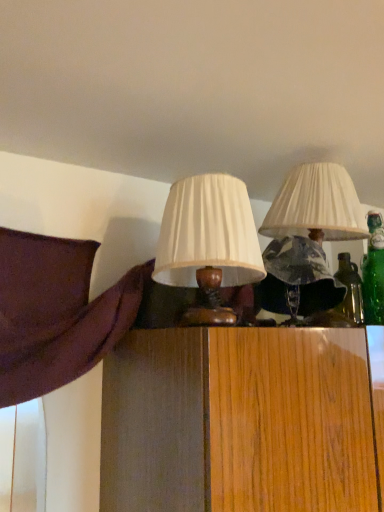
Question: Which direction should I rotate to look at matte white lampshade at center, which ranks as the 1th lamp in right-to-left order, — up or down?

Choices:
 (A) up
 (B) down

Answer: (A)

Question: Is matte white lampshade at center, which ranks as the 1th lamp in right-to-left order, positioned in front of matte white lampshade at center, the second lamp in the right-to-left sequence?

Choices:
 (A) no
 (B) yes

Answer: (A)

Question: From a real-world perspective, is matte white lampshade at center, which ranks as the 1th lamp in right-to-left order, located higher than matte white lampshade at center, placed as the first lamp when sorted from left to right?

Choices:
 (A) yes
 (B) no

Answer: (A)

Question: Is matte white lampshade at center, which ranks as the 1th lamp in right-to-left order, to the right of matte white lampshade at center, the second lamp in the right-to-left sequence, from the viewer's perspective?

Choices:
 (A) no
 (B) yes

Answer: (B)

Question: Is matte white lampshade at center, placed as the first lamp when sorted from left to right, located within matte white lampshade at center, the second lamp positioned from the left?

Choices:
 (A) no
 (B) yes

Answer: (A)

Question: Is matte white lampshade at center, placed as the first lamp when sorted from left to right, at the back of matte white lampshade at center, which ranks as the 1th lamp in right-to-left order?

Choices:
 (A) yes
 (B) no

Answer: (B)

Question: Does matte white lampshade at center, the second lamp positioned from the left, have a lesser height compared to matte white lampshade at center, placed as the first lamp when sorted from left to right?

Choices:
 (A) no
 (B) yes

Answer: (A)

Question: Is matte white lampshade at center, the second lamp in the right-to-left sequence, turned away from matte white lampshade at center, which ranks as the 1th lamp in right-to-left order?

Choices:
 (A) yes
 (B) no

Answer: (B)

Question: Is matte white lampshade at center, the second lamp in the right-to-left sequence, behind matte white lampshade at center, which ranks as the 1th lamp in right-to-left order?

Choices:
 (A) yes
 (B) no

Answer: (B)

Question: Does matte white lampshade at center, the second lamp in the right-to-left sequence, have a lesser width compared to matte white lampshade at center, the second lamp positioned from the left?

Choices:
 (A) no
 (B) yes

Answer: (B)

Question: Is matte white lampshade at center, placed as the first lamp when sorted from left to right, shorter than matte white lampshade at center, which ranks as the 1th lamp in right-to-left order?

Choices:
 (A) no
 (B) yes

Answer: (B)

Question: From a real-world perspective, does matte white lampshade at center, placed as the first lamp when sorted from left to right, stand above matte white lampshade at center, which ranks as the 1th lamp in right-to-left order?

Choices:
 (A) yes
 (B) no

Answer: (B)

Question: Does matte white lampshade at center, placed as the first lamp when sorted from left to right, lie in front of matte white lampshade at center, which ranks as the 1th lamp in right-to-left order?

Choices:
 (A) yes
 (B) no

Answer: (A)

Question: Is matte white lampshade at center, the second lamp positioned from the left, in front of or behind matte white lampshade at center, the second lamp in the right-to-left sequence, in the image?

Choices:
 (A) behind
 (B) front

Answer: (A)